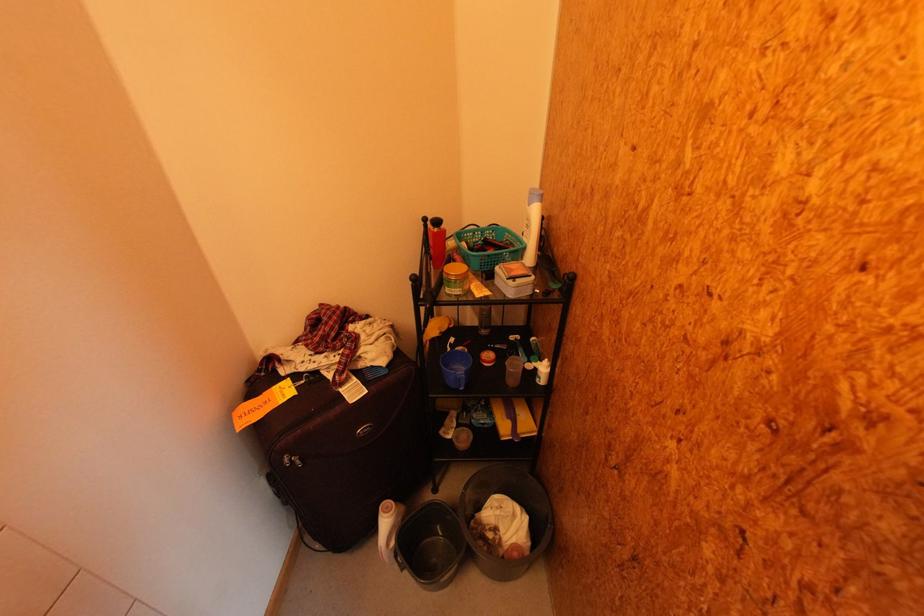
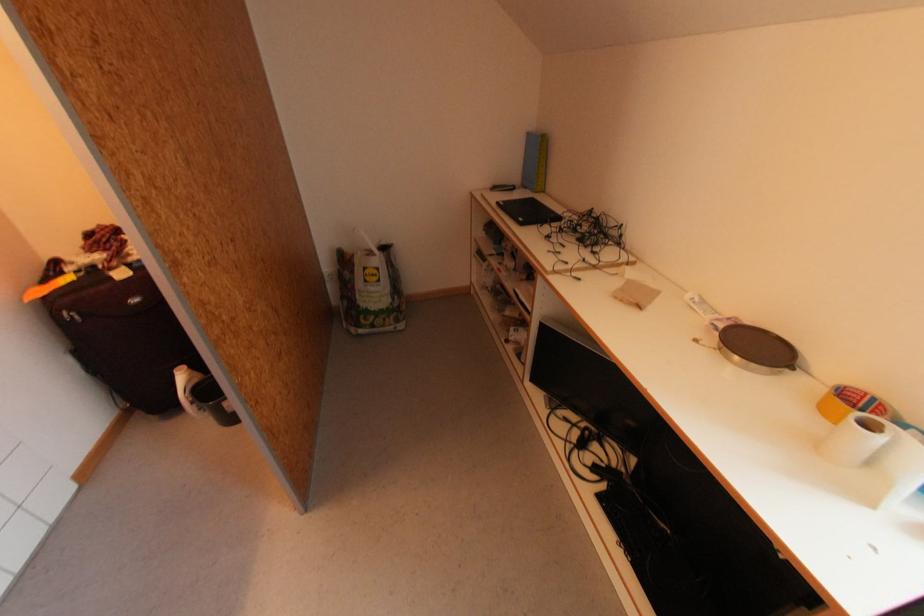
The point at [322,373] is marked in the first image. Where is the corresponding point in the second image?

(98, 267)